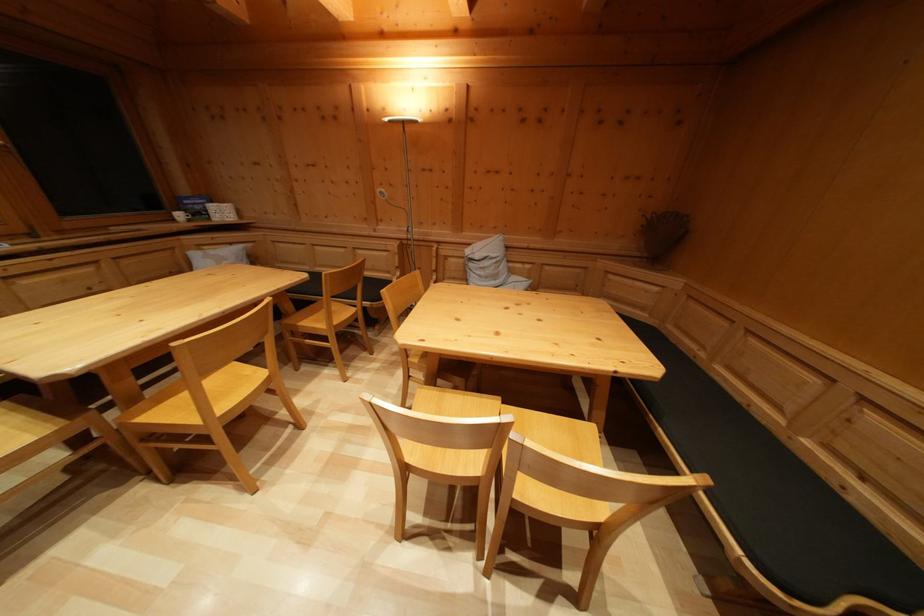
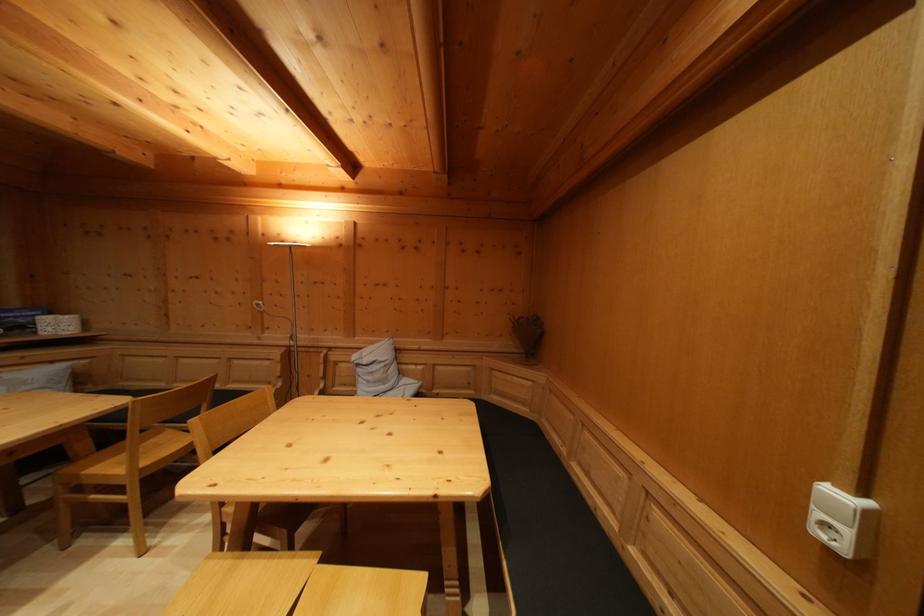
Question: The images are taken continuously from a first-person perspective. In which direction are you moving?

Choices:
 (A) Left
 (B) Right
 (C) Forward
 (D) Backward

Answer: (B)